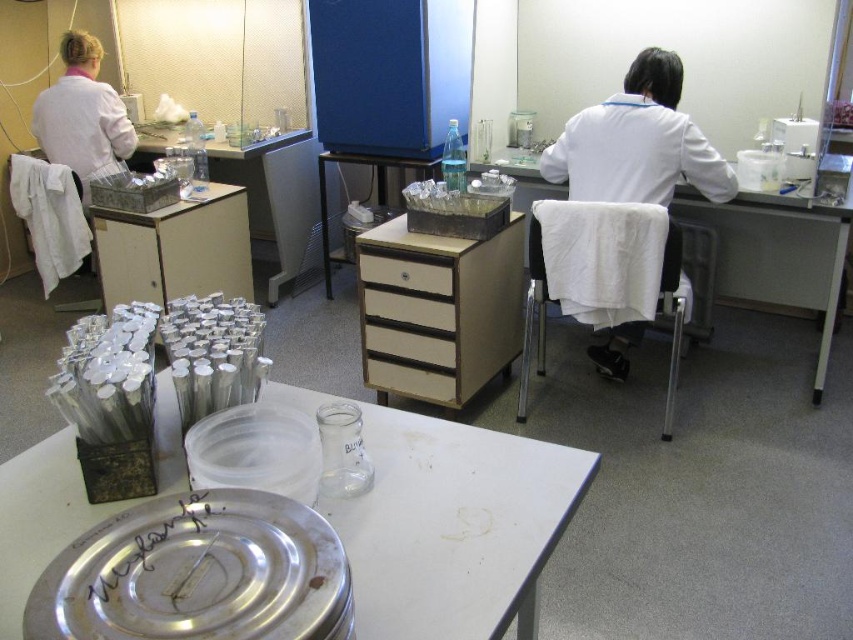
You are a researcher in a lab and need to locate your lab coats. You see the white matte lab coat at center and the white lab coat at left. Which one is positioned more to the left side of the table?

The white lab coat at left is positioned more to the left side of the table.